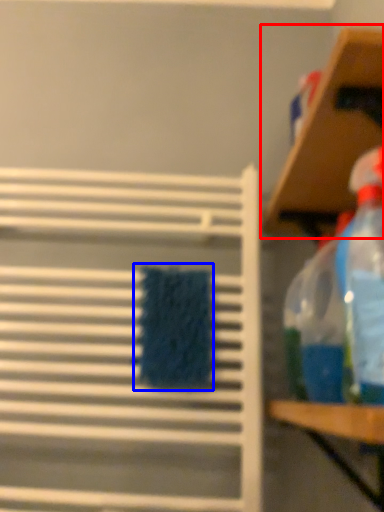
Question: Which object is further to the camera taking this photo, shelf (highlighted by a red box) or beach towel (highlighted by a blue box)?

Choices:
 (A) shelf
 (B) beach towel

Answer: (B)